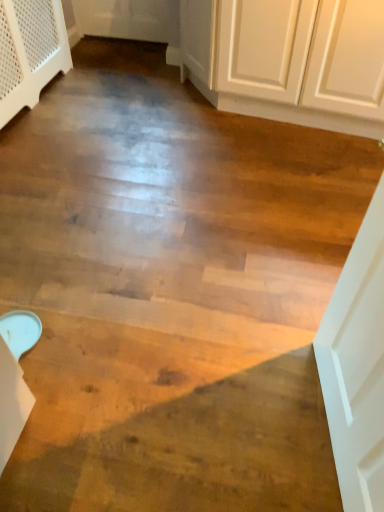
Question: From the image's perspective, is white matte door at right located beneath white textured dresser at upper left?

Choices:
 (A) no
 (B) yes

Answer: (B)

Question: Can you confirm if white matte door at right is wider than white textured dresser at upper left?

Choices:
 (A) no
 (B) yes

Answer: (A)

Question: Is white matte door at right outside of white textured dresser at upper left?

Choices:
 (A) no
 (B) yes

Answer: (B)

Question: Is white matte door at right positioned with its back to white textured dresser at upper left?

Choices:
 (A) no
 (B) yes

Answer: (A)

Question: Is white matte door at right closer to camera compared to white textured dresser at upper left?

Choices:
 (A) no
 (B) yes

Answer: (B)

Question: Considering the relative positions of white matte door at right and white textured dresser at upper left in the image provided, is white matte door at right to the right of white textured dresser at upper left from the viewer's perspective?

Choices:
 (A) no
 (B) yes

Answer: (B)

Question: Does white textured dresser at upper left have a lesser height compared to white matte door at right?

Choices:
 (A) yes
 (B) no

Answer: (A)

Question: Does white textured dresser at upper left lie in front of white matte door at right?

Choices:
 (A) yes
 (B) no

Answer: (B)

Question: Is white textured dresser at upper left to the right of white matte door at right from the viewer's perspective?

Choices:
 (A) no
 (B) yes

Answer: (A)

Question: Is white matte door at right at the back of white textured dresser at upper left?

Choices:
 (A) no
 (B) yes

Answer: (A)

Question: From the image's perspective, is white textured dresser at upper left on white matte door at right?

Choices:
 (A) no
 (B) yes

Answer: (B)

Question: Can you see white textured dresser at upper left touching white matte door at right?

Choices:
 (A) no
 (B) yes

Answer: (A)

Question: Looking at their shapes, would you say white textured dresser at upper left is wider or thinner than white matte door at right?

Choices:
 (A) thin
 (B) wide

Answer: (B)